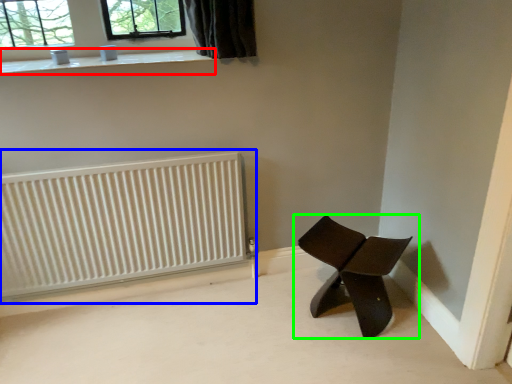
Question: Estimate the real-world distances between objects in this image. Which object is farther from window sill (highlighted by a red box), radiator (highlighted by a blue box) or chair (highlighted by a green box)?

Choices:
 (A) radiator
 (B) chair

Answer: (B)